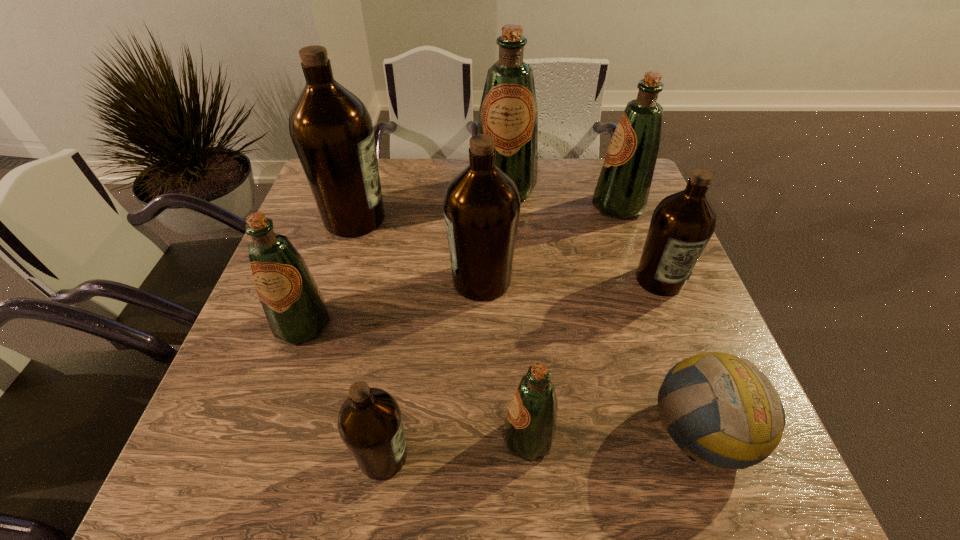
In order to click on olive oil identified as the closest to the third brown olive oil from left to right in this screenshot , I will do `click(331, 129)`.

Image resolution: width=960 pixels, height=540 pixels. Find the location of `green olive oil that stands as the third closest to the second nearest green olive oil`. green olive oil that stands as the third closest to the second nearest green olive oil is located at coordinates (622, 190).

Choose which green olive oil is the second nearest neighbor to the second smallest green olive oil. Please provide its 2D coordinates. Your answer should be formatted as a tuple, i.e. [(x, y)], where the tuple contains the x and y coordinates of a point satisfying the conditions above.

[(508, 112)]

Identify which brown olive oil is the closest to the biggest brown olive oil. Please provide its 2D coordinates. Your answer should be formatted as a tuple, i.e. [(x, y)], where the tuple contains the x and y coordinates of a point satisfying the conditions above.

[(482, 205)]

Locate which brown olive oil ranks fourth in proximity to the volleyball. Please provide its 2D coordinates. Your answer should be formatted as a tuple, i.e. [(x, y)], where the tuple contains the x and y coordinates of a point satisfying the conditions above.

[(331, 129)]

Where is `free location that satisfies the following two spatial constraints: 1. on the front-facing side of the second smallest green olive oil; 2. on the left side of the volleyball`? The height and width of the screenshot is (540, 960). free location that satisfies the following two spatial constraints: 1. on the front-facing side of the second smallest green olive oil; 2. on the left side of the volleyball is located at coordinates (266, 431).

This screenshot has height=540, width=960. In order to click on vacant point that satisfies the following two spatial constraints: 1. on the label of the shortest object; 2. on the right side of the second brown olive oil from right to left in this screenshot , I will do `click(482, 431)`.

Identify the location of vacant region that satisfies the following two spatial constraints: 1. on the front-facing side of the rightmost green olive oil; 2. on the front-facing side of the second nearest green olive oil. Image resolution: width=960 pixels, height=540 pixels. [660, 325].

Locate an element on the screen. Image resolution: width=960 pixels, height=540 pixels. vacant region that satisfies the following two spatial constraints: 1. on the label of the leftmost brown olive oil; 2. on the left side of the shortest object is located at coordinates (288, 431).

At what (x,y) coordinates should I click in order to perform the action: click on free spot that satisfies the following two spatial constraints: 1. on the front-facing side of the third biggest green olive oil; 2. on the left side of the volleyball. Please return your answer as a coordinate pair (x, y). This screenshot has width=960, height=540. Looking at the image, I should click on (266, 431).